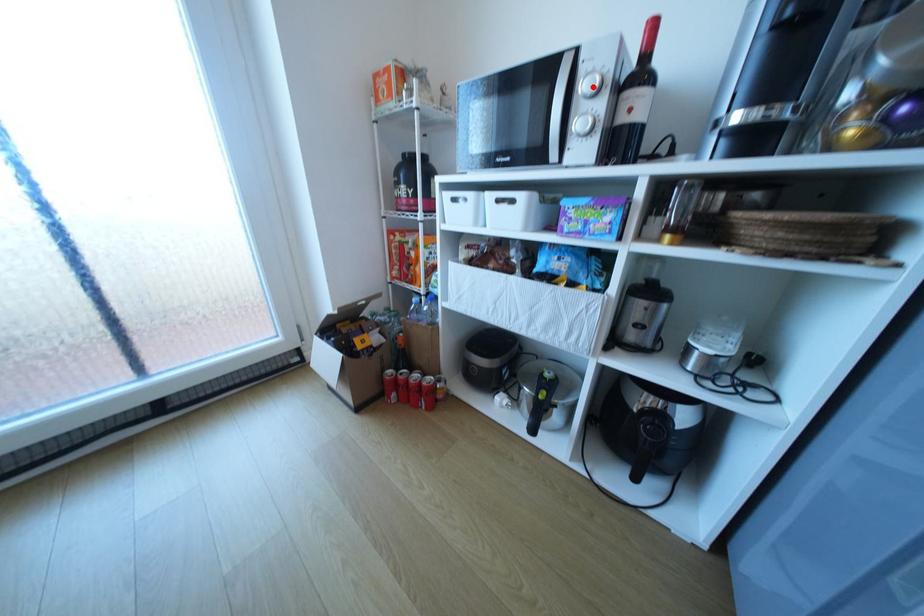
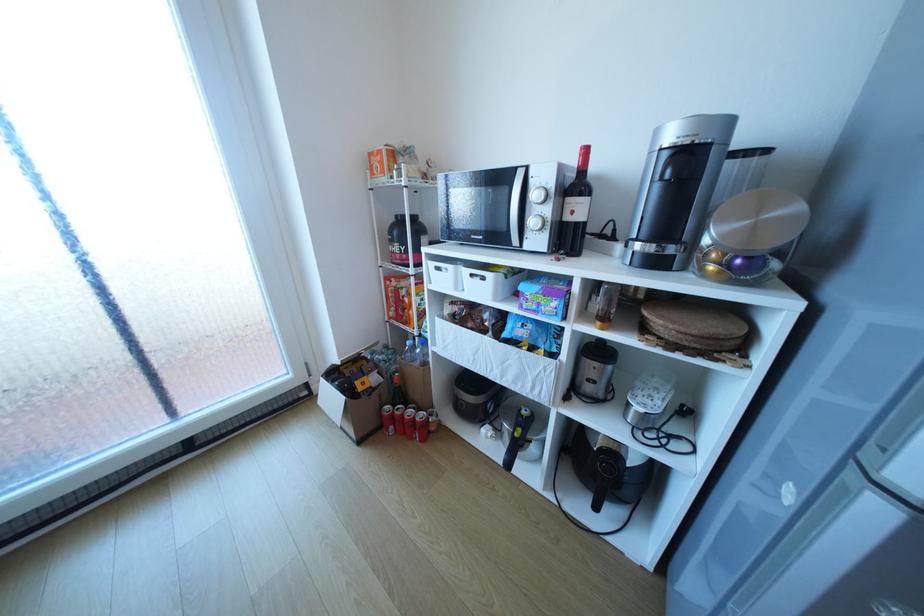
The point at the highlighted location is marked in the first image. Where is the corresponding point in the second image?

(542, 195)